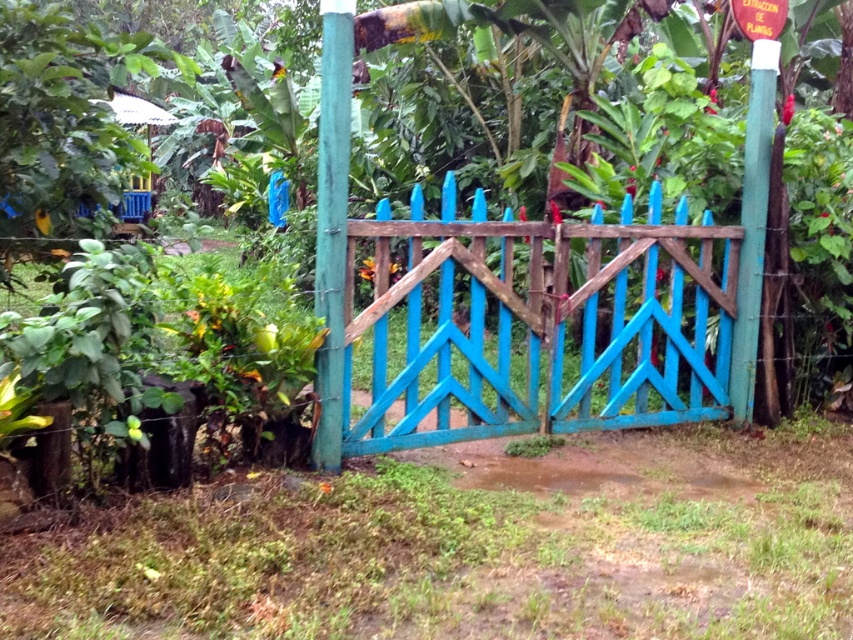
Based on the photo, is teal wood post at center shorter than white painted wood pole at upper right?

Indeed, teal wood post at center has a lesser height compared to white painted wood pole at upper right.

Is point (329, 275) positioned in front of point (741, 296)?

Yes, it is in front of point (741, 296).

Is point (334, 385) behind point (751, 262)?

That is False.

Where is `teal wood post at center`? teal wood post at center is located at coordinates (332, 225).

Between blue painted wood gate at center and teal wood post at center, which one has less height?

Standing shorter between the two is blue painted wood gate at center.

Find the location of a particular element. Image resolution: width=853 pixels, height=640 pixels. blue painted wood gate at center is located at coordinates (537, 323).

This screenshot has width=853, height=640. What are the coordinates of `blue painted wood gate at center` in the screenshot? It's located at (537, 323).

Does point (672, 256) come behind point (753, 248)?

No.

Can you confirm if blue painted wood gate at center is wider than white painted wood pole at upper right?

Yes, blue painted wood gate at center is wider than white painted wood pole at upper right.

The image size is (853, 640). I want to click on blue painted wood gate at center, so click(537, 323).